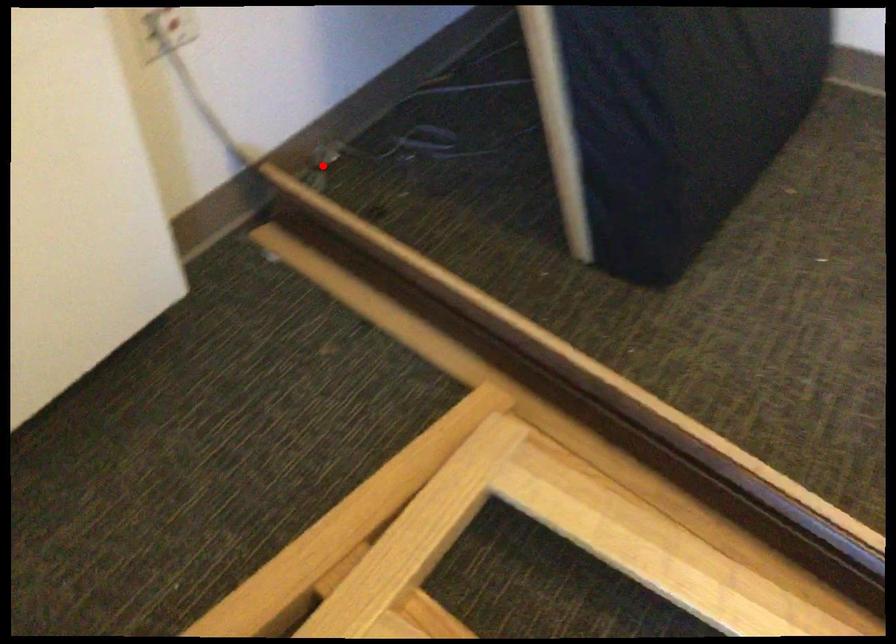
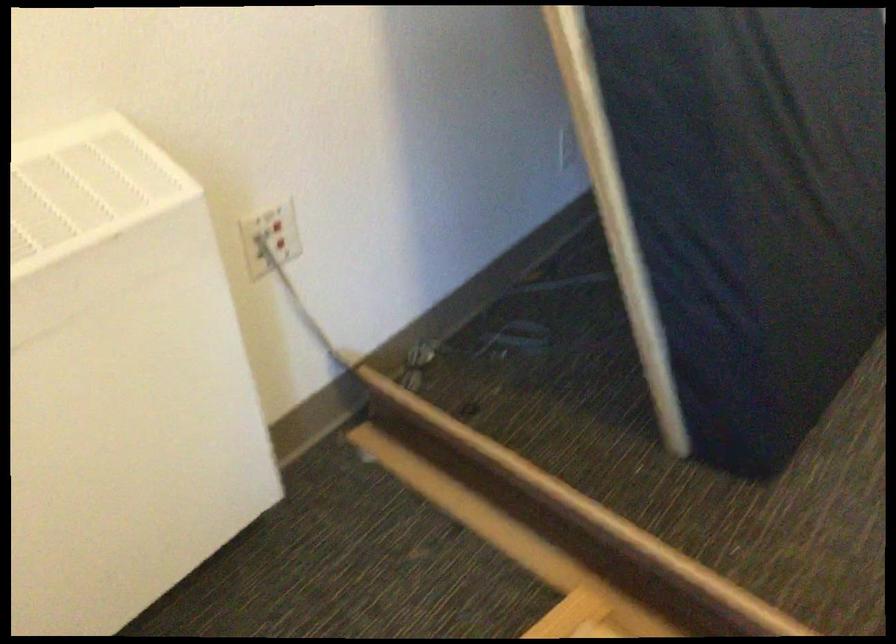
In the second image, find the point that corresponds to the highlighted location in the first image.

(418, 363)